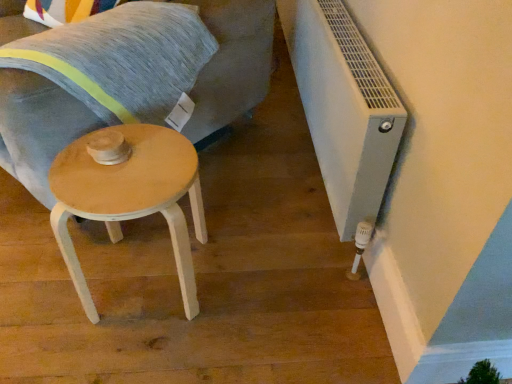
You are a GUI agent. You are given a task and a screenshot of the screen. Output one action in this format:
    pyautogui.click(x=<x>, y=<y>)
    Task: Click on the free space in front of light wood/wooden stool at lower left
    
    Given the screenshot: What is the action you would take?
    pyautogui.click(x=128, y=350)